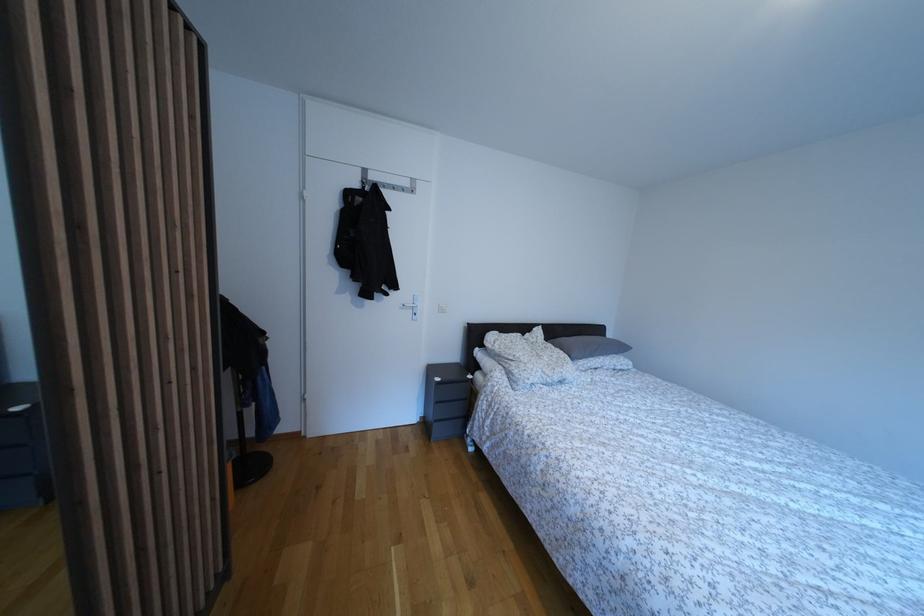
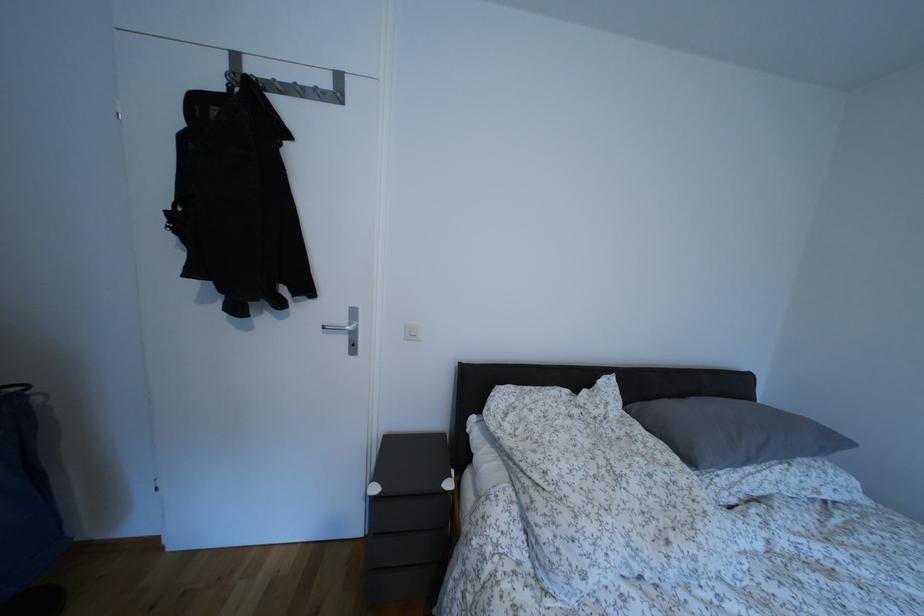
Question: What movement of the cameraman would produce the second image?

Choices:
 (A) Left
 (B) Right
 (C) Forward
 (D) Backward

Answer: (C)